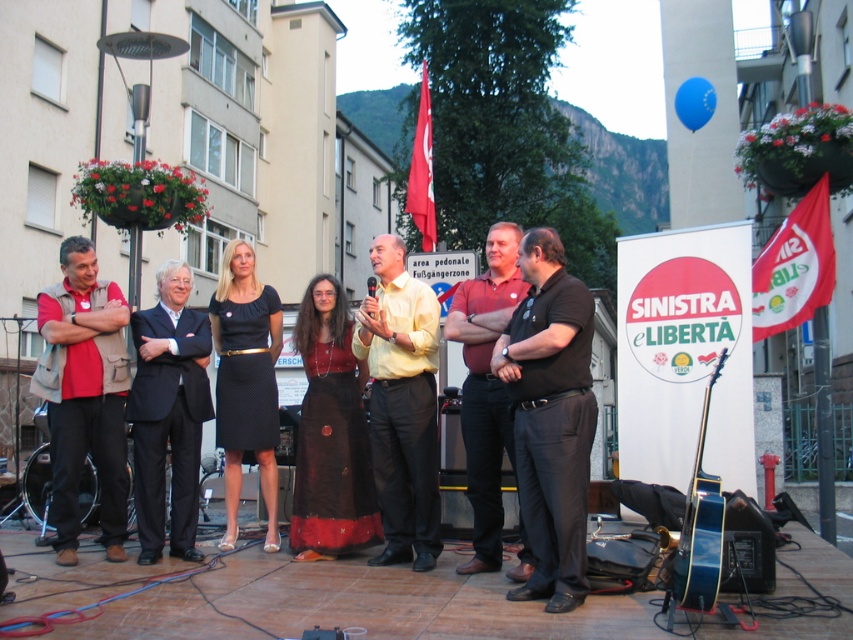
You are a photographer at the event and want to ensure all subjects are visible in the photo. Considering the black smooth shirt at center and the black satin dress at center, which one might be partially hidden if you focus on the shorter subject?

The black smooth shirt at center is not as tall as the black satin dress at center, so focusing on the shorter subject might cause the taller black satin dress at center to be partially hidden.

From the picture: You are a photographer at the event and need to ensure all participants are visible in the photo. The black smooth shirt at center and the matte red shirt at center are both in the frame. Which shirt should you focus on to ensure the shorter one is in focus?

The black smooth shirt at center is shorter than the matte red shirt at center, so focusing on the black smooth shirt at center will ensure the shorter one is in focus.